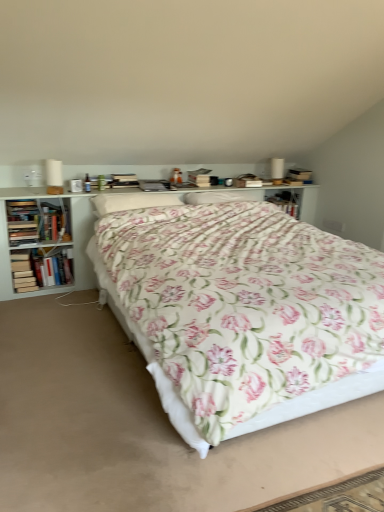
Question: Choose the correct answer: Is white soft pillow at center inside hardcover book at left, the second book viewed from the top, or outside it?

Choices:
 (A) inside
 (B) outside

Answer: (B)

Question: Considering the positions of white soft pillow at center and hardcover book at left, the second book when ordered from bottom to top, in the image, is white soft pillow at center bigger or smaller than hardcover book at left, the second book when ordered from bottom to top,?

Choices:
 (A) big
 (B) small

Answer: (A)

Question: Which object is the closest to the floral fabric bed at center?

Choices:
 (A) white soft pillow at center
 (B) hardcover book at left, which is counted as the 3th book, starting from the top
 (C) white wood bookcase at center
 (D) hardcover book at left, which is the 1th book from top to bottom
 (E) hardcover book at left, the second book viewed from the top

Answer: (A)

Question: Which is farther from the white wood bookcase at center?

Choices:
 (A) hardcover book at left, the second book when ordered from bottom to top
 (B) white soft pillow at center
 (C) hardcover book at left, arranged as the 3th book when ordered from the bottom
 (D) floral fabric bed at center
 (E) hardcover book at left, the first book in the bottom-to-top sequence

Answer: (D)